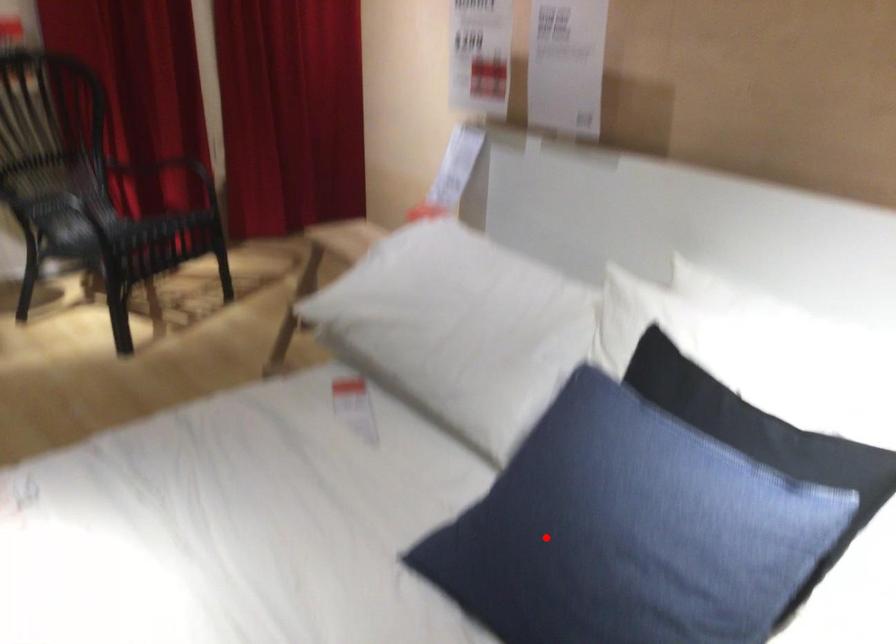
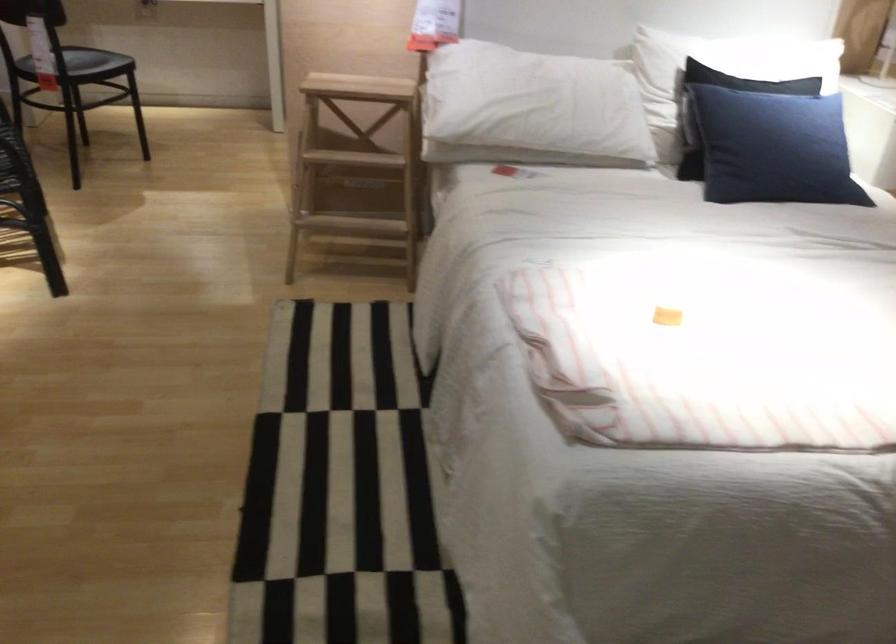
Question: I am providing you with two images of the same scene from different viewpoints. Image1 has a red point marked. In image2, the corresponding 3D location appears at what relative position? Reply with the corresponding letter.

Choices:
 (A) Closer
 (B) Farther

Answer: (B)